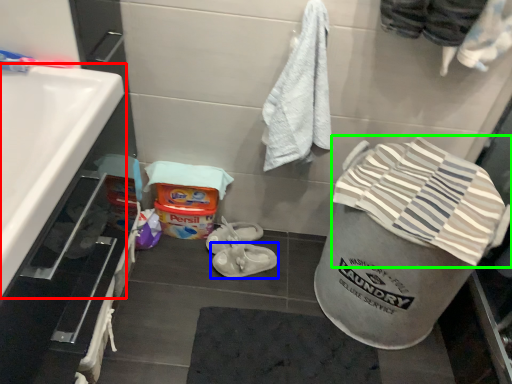
Question: Estimate the real-world distances between objects in this image. Which object is farther from sink (highlighted by a red box), footwear (highlighted by a blue box) or beach towel (highlighted by a green box)?

Choices:
 (A) footwear
 (B) beach towel

Answer: (A)